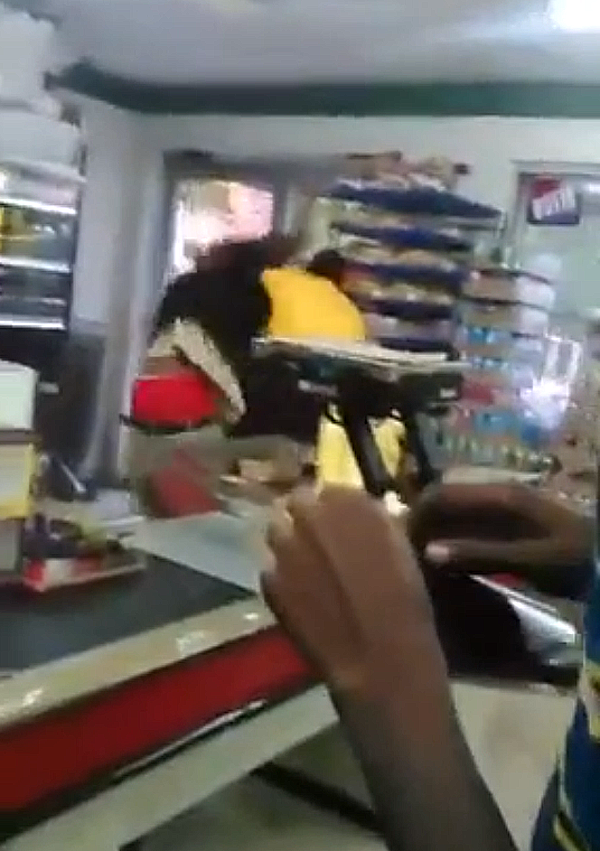
Where is `top clear container with blue lid`? This screenshot has width=600, height=851. top clear container with blue lid is located at coordinates (435, 197).